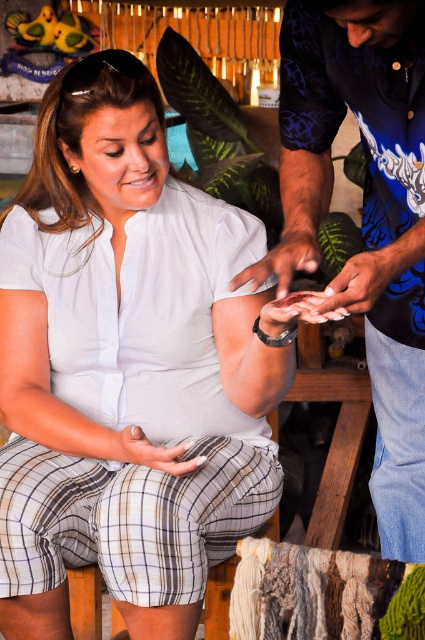
You are a photographer trying to capture a clear photo of both the white matte shirt at center and the blue printed shirt at center. Which shirt should you focus on first to ensure both are in focus?

You should focus on the white matte shirt at center first because it is closer to you than the blue printed shirt at center. By focusing on the closer object, the background object will also be in focus due to the depth of field.

You are trying to decide which shirt to wear for a casual day out. Both the white matte shirt at center and the blue printed shirt at center are options. Based on their sizes, which one would you choose if you prefer a looser fit?

The white matte shirt at center has a larger width than the blue printed shirt at center, so it would provide a looser fit and be the better choice for a casual day out.

You are taking a photo of the two people in the craft activity scene. The camera is focused on the point at (224, 246). Will the point at (388, 122) also be in focus?

Point (224, 246) is further to the camera than point (388, 122). Since the camera is focused on the closer point, the point at (388, 122) will be out of focus.